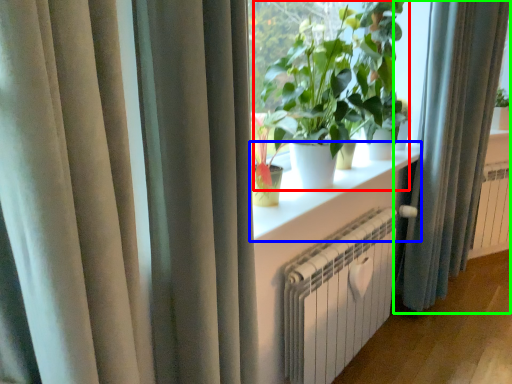
Question: Based on their relative distances, which object is nearer to houseplant (highlighted by a red box)? Choose from window sill (highlighted by a blue box) and curtain (highlighted by a green box).

Choices:
 (A) window sill
 (B) curtain

Answer: (A)